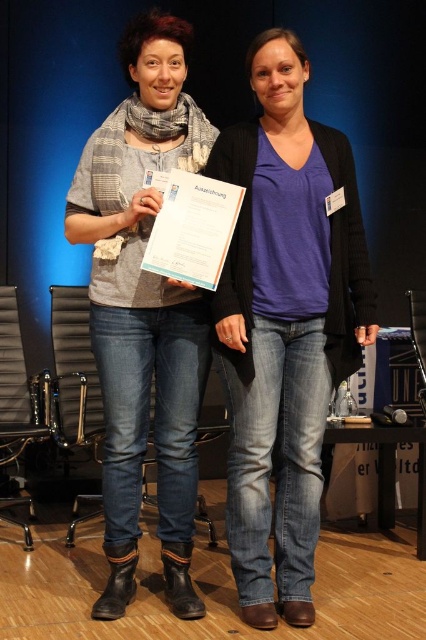
You are attending an indoor event and need to determine which clothing item is taller between the purple matte shirt at center and the matte gray scarf at center. Based on the scene description, which one is taller?

The purple matte shirt at center is shorter than the matte gray scarf at center, so the matte gray scarf at center is taller.